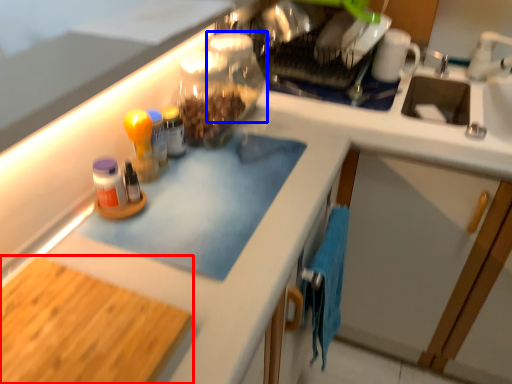
Question: Among these objects, which one is nearest to the camera, cutting board (highlighted by a red box) or glass jar (highlighted by a blue box)?

Choices:
 (A) cutting board
 (B) glass jar

Answer: (A)